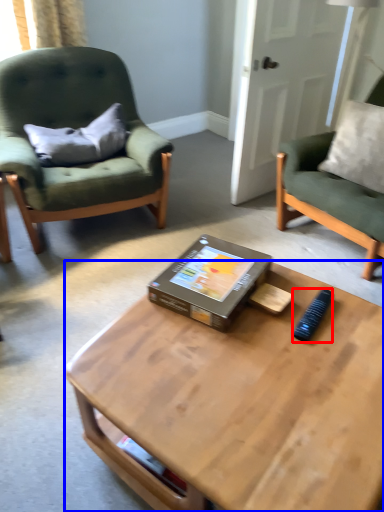
Question: Which of the following is the closest to the observer, remote control (highlighted by a red box) or coffee table (highlighted by a blue box)?

Choices:
 (A) remote control
 (B) coffee table

Answer: (B)